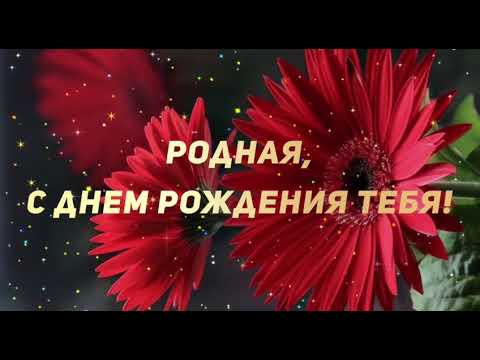
Locate an element on the screen. The width and height of the screenshot is (480, 360). center flower is located at coordinates (198, 218).